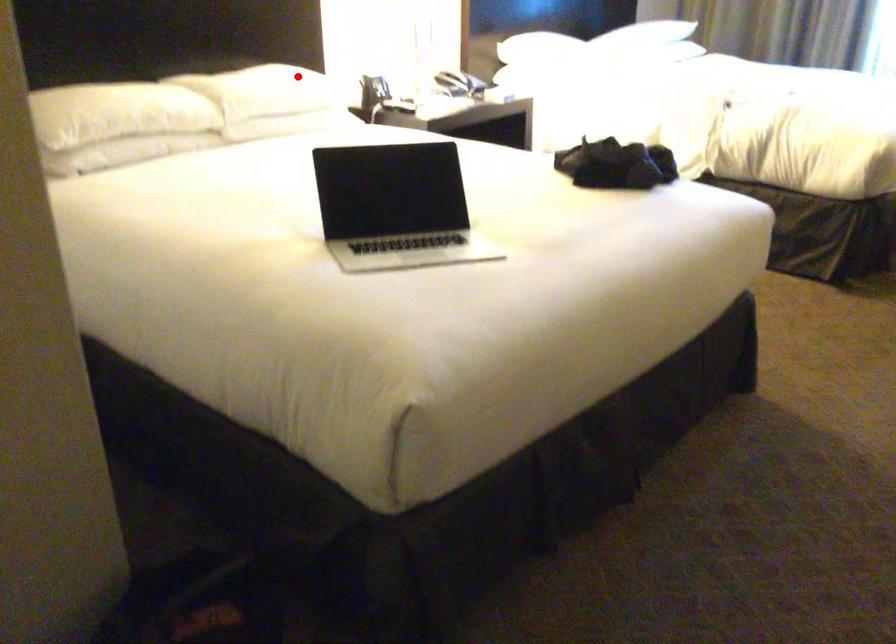
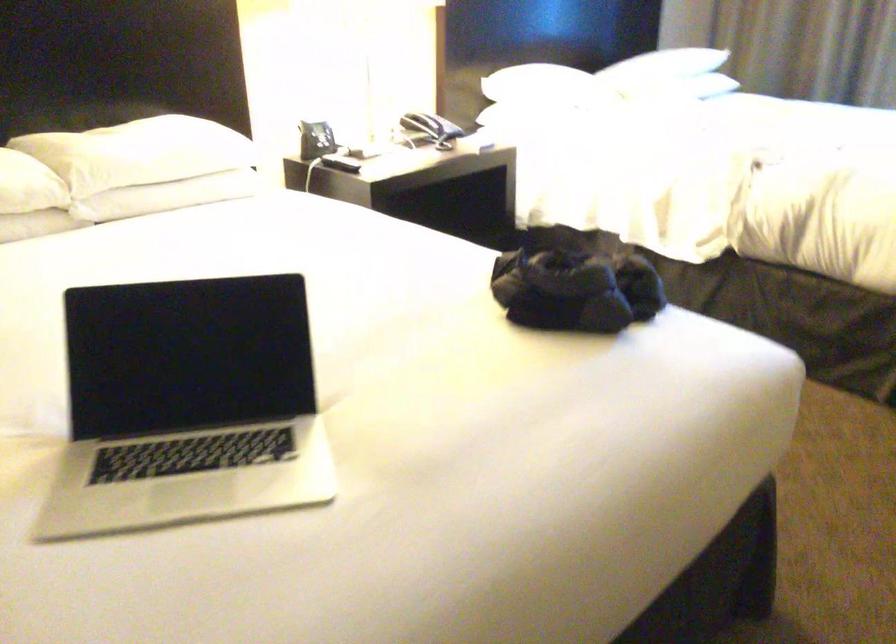
Question: I am providing you with two images of the same scene from different viewpoints. Given a red point in image1, look at the same physical point in image2. Is it:

Choices:
 (A) Closer to the viewpoint
 (B) Farther from the viewpoint

Answer: (A)